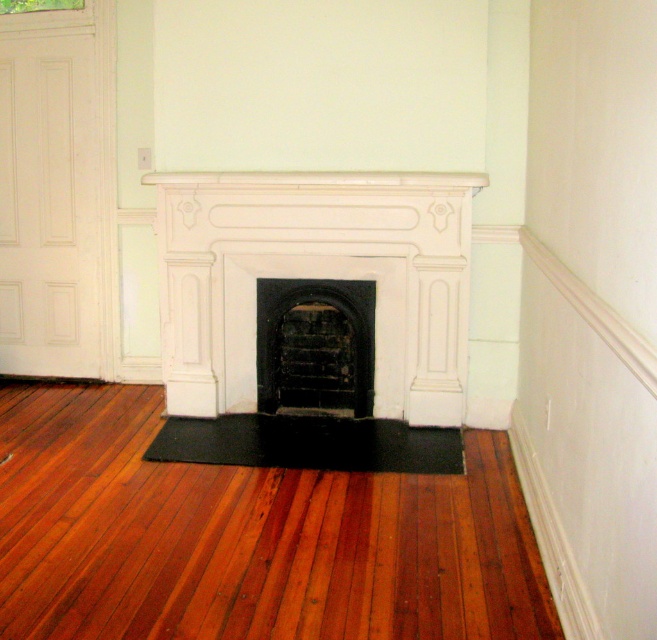
Question: Does shiny brown wood flooring at center lie in front of white stone fireplace at center?

Choices:
 (A) no
 (B) yes

Answer: (B)

Question: Which point is farther to the camera?

Choices:
 (A) pos(152,614)
 (B) pos(403,449)
 (C) pos(292,275)
 (D) pos(283,317)

Answer: (D)

Question: Which object appears closest to the camera in this image?

Choices:
 (A) shiny brown wood flooring at center
 (B) black rubber mat at center
 (C) white stone fireplace at center

Answer: (A)

Question: Which of the following is the closest to the observer?

Choices:
 (A) [x=338, y=340]
 (B) [x=246, y=422]
 (C) [x=401, y=179]
 (D) [x=185, y=566]

Answer: (D)

Question: Is black matte fireplace at center thinner than black rubber mat at center?

Choices:
 (A) yes
 (B) no

Answer: (A)

Question: Considering the relative positions of white stone fireplace at center and black matte fireplace at center in the image provided, where is white stone fireplace at center located with respect to black matte fireplace at center?

Choices:
 (A) below
 (B) above

Answer: (B)